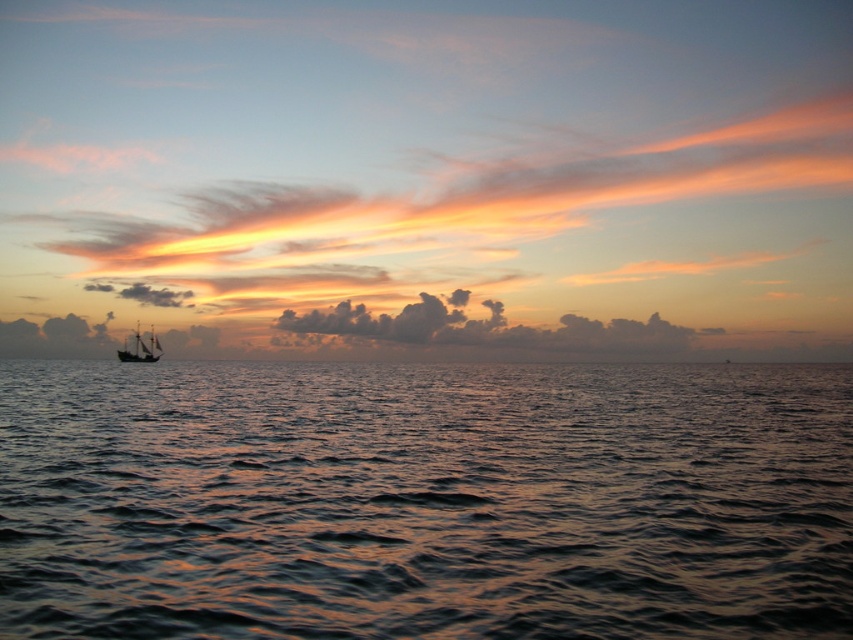
Question: Is cloudy sky at center below wooden ship at left?

Choices:
 (A) no
 (B) yes

Answer: (A)

Question: Which object is closer to the camera taking this photo?

Choices:
 (A) cloudy sky at center
 (B) glistening water at center

Answer: (B)

Question: Estimate the real-world distances between objects in this image. Which object is farther from the cloudy sky at center?

Choices:
 (A) glistening water at center
 (B) wooden ship at left

Answer: (A)

Question: Can you confirm if cloudy sky at center is smaller than wooden ship at left?

Choices:
 (A) no
 (B) yes

Answer: (A)

Question: Which object is closer to the camera taking this photo?

Choices:
 (A) wooden ship at left
 (B) cloudy sky at center
 (C) glistening water at center

Answer: (C)

Question: Is glistening water at center to the right of wooden ship at left from the viewer's perspective?

Choices:
 (A) no
 (B) yes

Answer: (B)